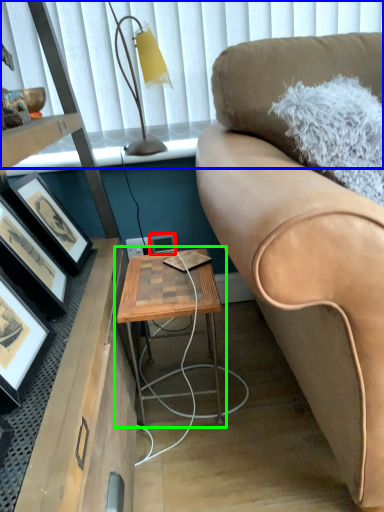
Question: Based on their relative distances, which object is farther from picture frame (highlighted by a red box)? Choose from window screen (highlighted by a blue box) and table (highlighted by a green box).

Choices:
 (A) window screen
 (B) table

Answer: (A)